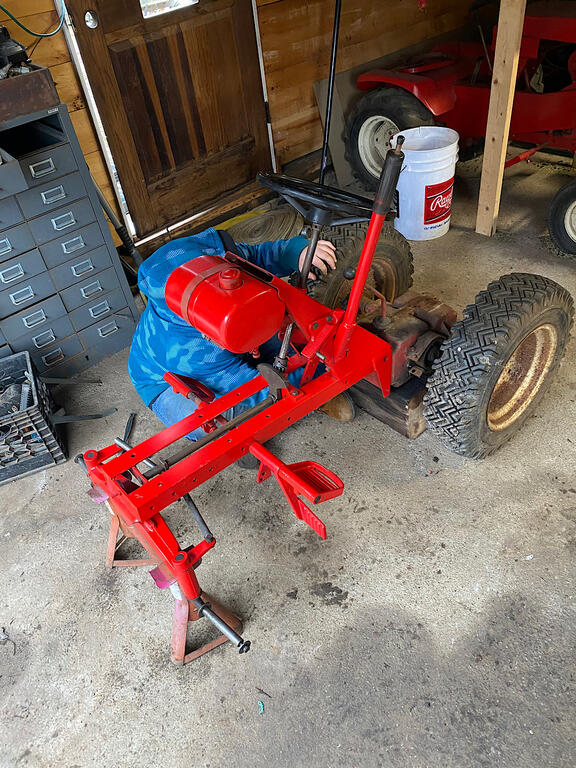
Locate an element on the screen. door is located at coordinates (162, 106).